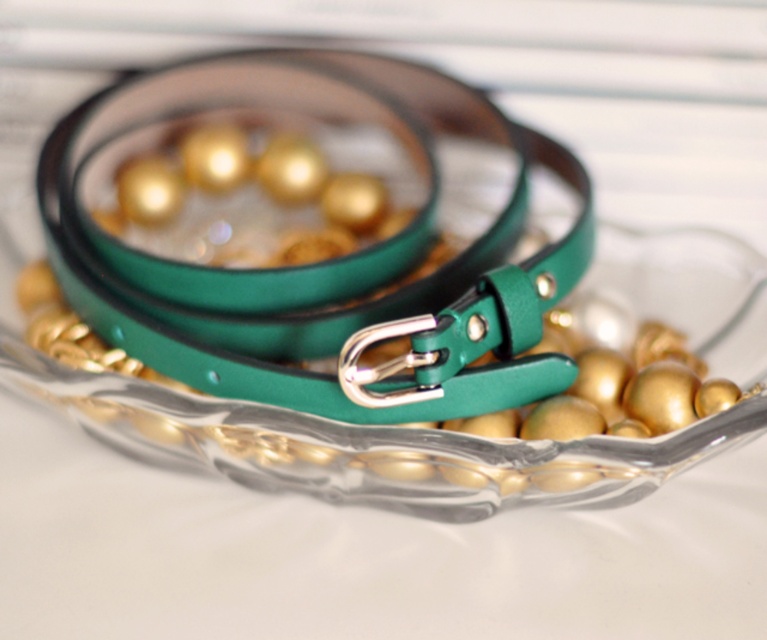
Question: Which of the following is the closest to the observer?

Choices:
 (A) (107, 209)
 (B) (189, 412)

Answer: (B)

Question: Can you confirm if green leather belt at center is positioned below transparent glass bowl at center?

Choices:
 (A) no
 (B) yes

Answer: (A)

Question: Is green leather belt at center to the right of transparent glass bowl at center from the viewer's perspective?

Choices:
 (A) no
 (B) yes

Answer: (A)

Question: Where is green leather belt at center located in relation to transparent glass bowl at center in the image?

Choices:
 (A) below
 (B) above

Answer: (B)

Question: Which object is closer to the camera taking this photo?

Choices:
 (A) transparent glass bowl at center
 (B) green leather belt at center

Answer: (A)